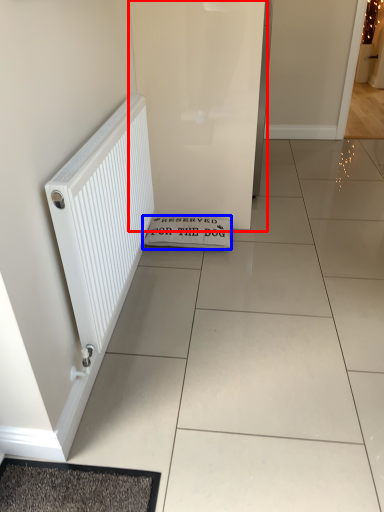
Question: Which point is closer to the camera, screen door (highlighted by a red box) or doormat (highlighted by a blue box)?

Choices:
 (A) screen door
 (B) doormat

Answer: (A)